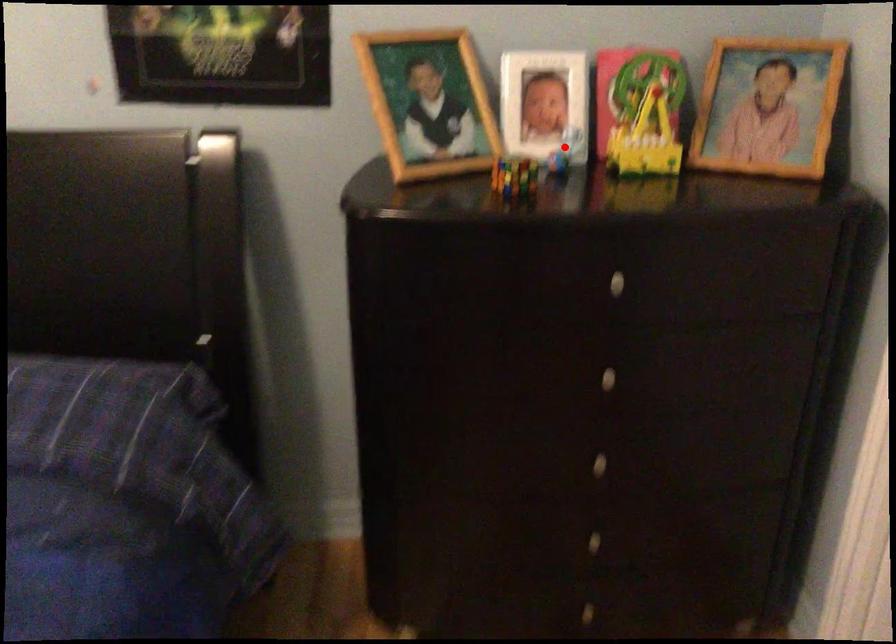
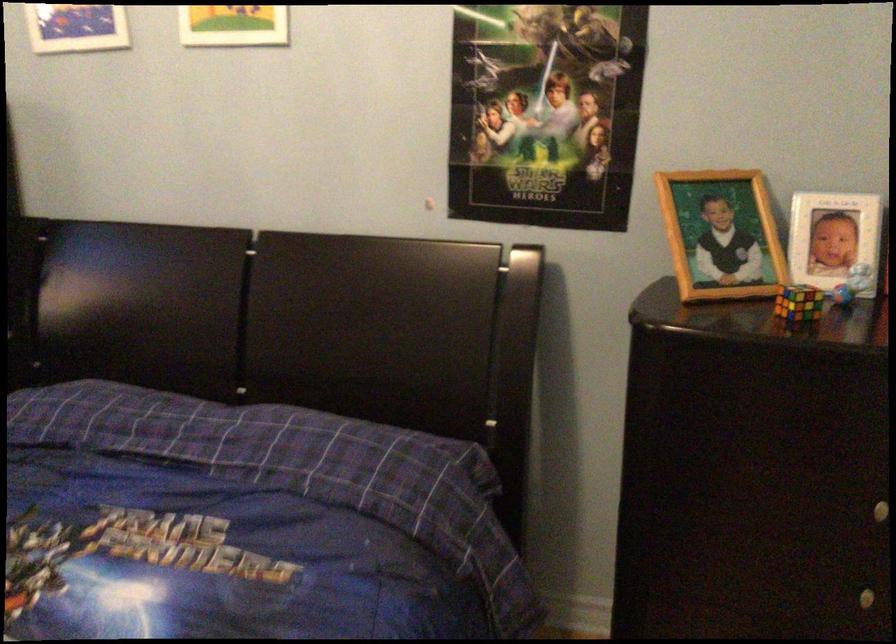
Where in the second image is the point corresponding to the highlighted location from the first image?

(851, 283)